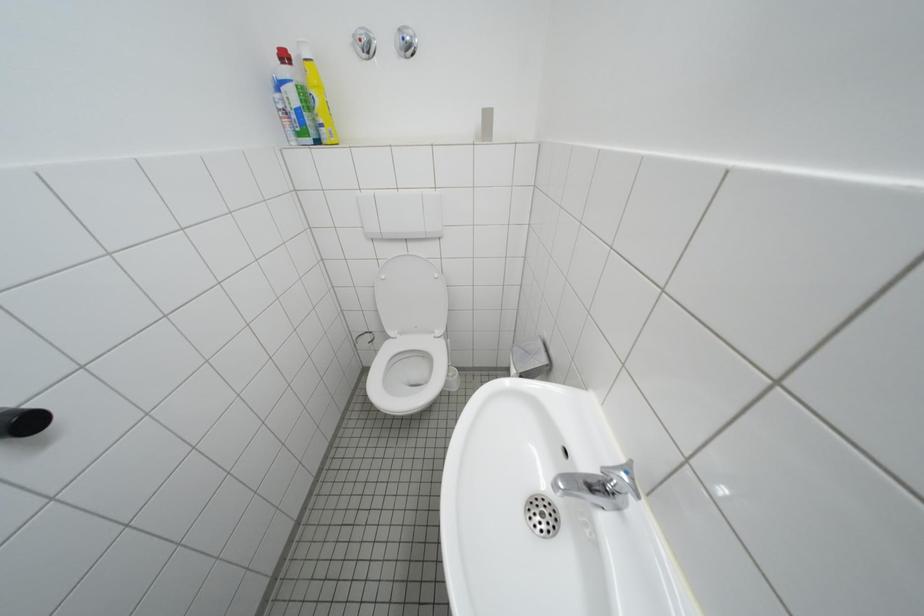
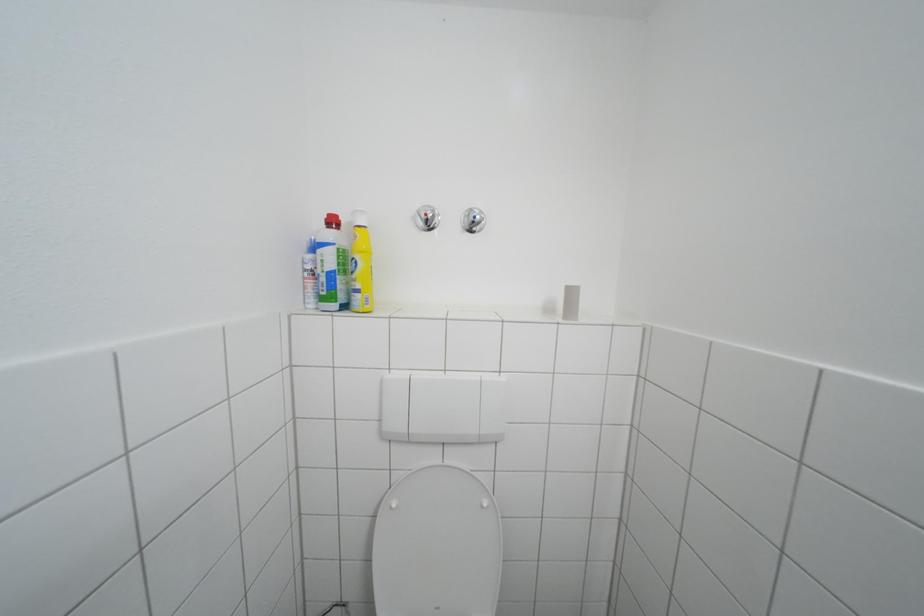
Question: How did the camera likely rotate?

Choices:
 (A) Left
 (B) Right
 (C) Up
 (D) Down

Answer: (C)